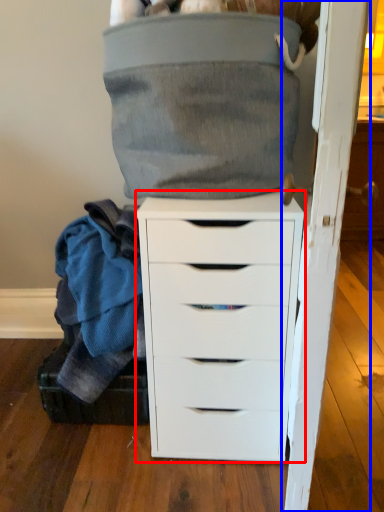
Question: Which object is closer to the camera taking this photo, chest of drawers (highlighted by a red box) or door (highlighted by a blue box)?

Choices:
 (A) chest of drawers
 (B) door

Answer: (A)